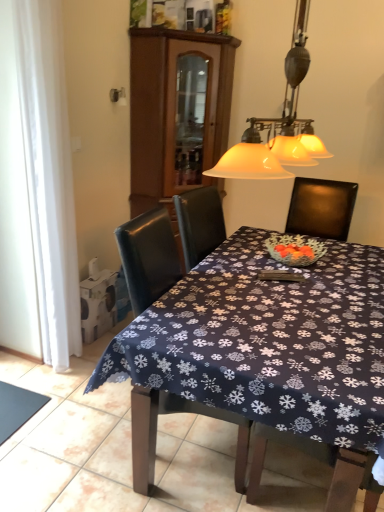
Question: Looking at their shapes, would you say dark blue fabric at lower left is wider or thinner than leather chair at center?

Choices:
 (A) wide
 (B) thin

Answer: (B)

Question: Considering the positions of point (13, 421) and point (135, 424), is point (13, 421) closer or farther from the camera than point (135, 424)?

Choices:
 (A) farther
 (B) closer

Answer: (A)

Question: Considering the real-world distances, which object is farthest from the white glass lampshade at upper center?

Choices:
 (A) white sheer curtain at left
 (B) brown wood cabinet at upper center
 (C) dark blue fabric at lower left
 (D) dark blue fabric tablecloth at center
 (E) leather chair at center

Answer: (C)

Question: Which object is the farthest from the white glass lampshade at upper center?

Choices:
 (A) leather chair at center
 (B) white sheer curtain at left
 (C) dark blue fabric at lower left
 (D) dark blue fabric tablecloth at center
 (E) brown wood cabinet at upper center

Answer: (C)